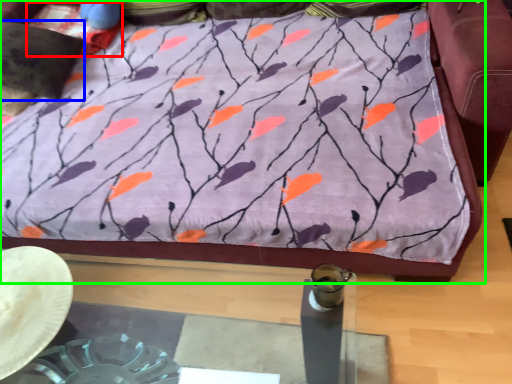
Question: Estimate the real-world distances between objects in this image. Which object is closer to pillow (highlighted by a red box), pillow (highlighted by a blue box) or furniture (highlighted by a green box)?

Choices:
 (A) pillow
 (B) furniture

Answer: (A)